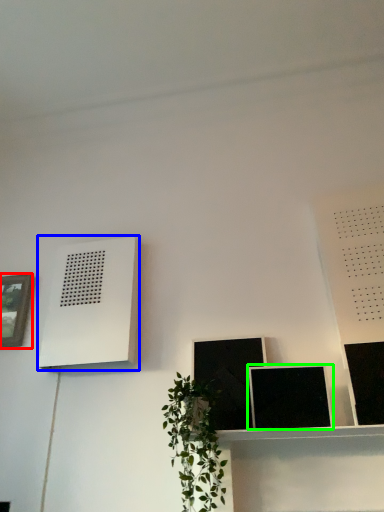
Question: Estimate the real-world distances between objects in this image. Which object is closer to picture frame (highlighted by a red box), air conditioner (highlighted by a blue box) or picture frame (highlighted by a green box)?

Choices:
 (A) air conditioner
 (B) picture frame

Answer: (A)